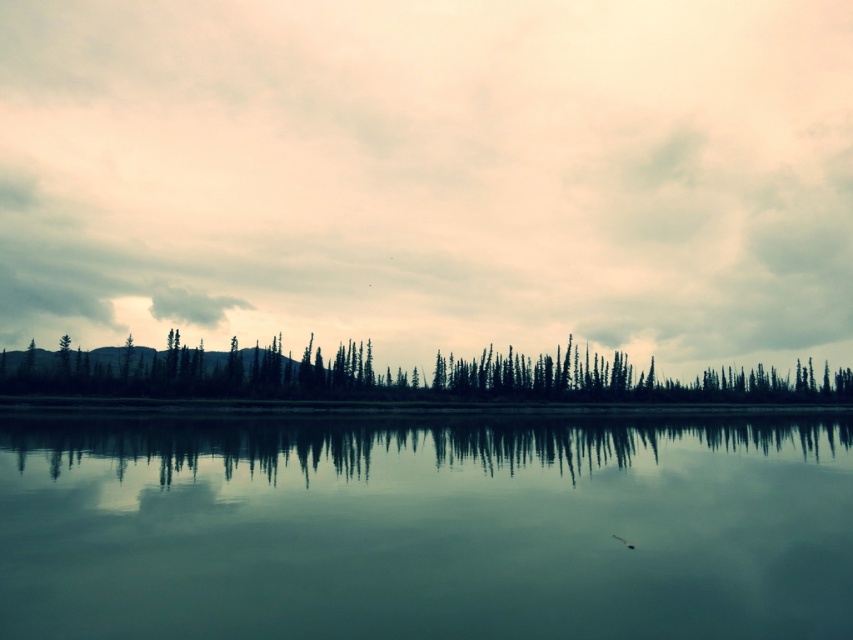
Looking at the scene, where is the cloudy sky at upper center in relation to the smooth glass water at center?

The cloudy sky at upper center is to the left of the smooth glass water at center.